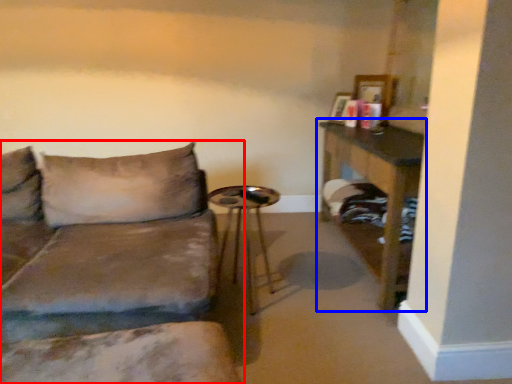
Question: Which of the following is the closest to the observer, studio couch (highlighted by a red box) or table (highlighted by a blue box)?

Choices:
 (A) studio couch
 (B) table

Answer: (A)